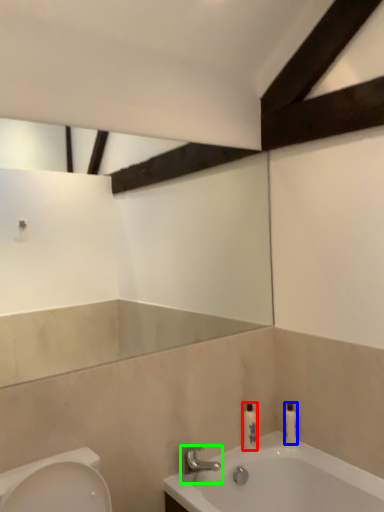
Question: Considering the real-world distances, which object is closest to toiletry (highlighted by a red box)? toiletry (highlighted by a blue box) or tap (highlighted by a green box).

Choices:
 (A) toiletry
 (B) tap

Answer: (A)